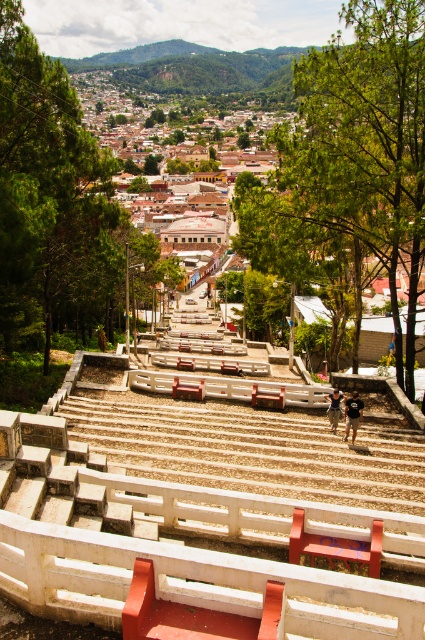
Question: Does green leafy tree at upper center have a lesser width compared to green leafy tree at upper left?

Choices:
 (A) yes
 (B) no

Answer: (B)

Question: Is green leafy tree at upper center thinner than green leafy tree at upper left?

Choices:
 (A) yes
 (B) no

Answer: (B)

Question: Which object is closer to the camera taking this photo?

Choices:
 (A) green leafy tree at upper left
 (B) green leafy tree at upper center

Answer: (A)

Question: Does green leafy tree at upper center appear on the right side of green leafy tree at upper left?

Choices:
 (A) no
 (B) yes

Answer: (B)